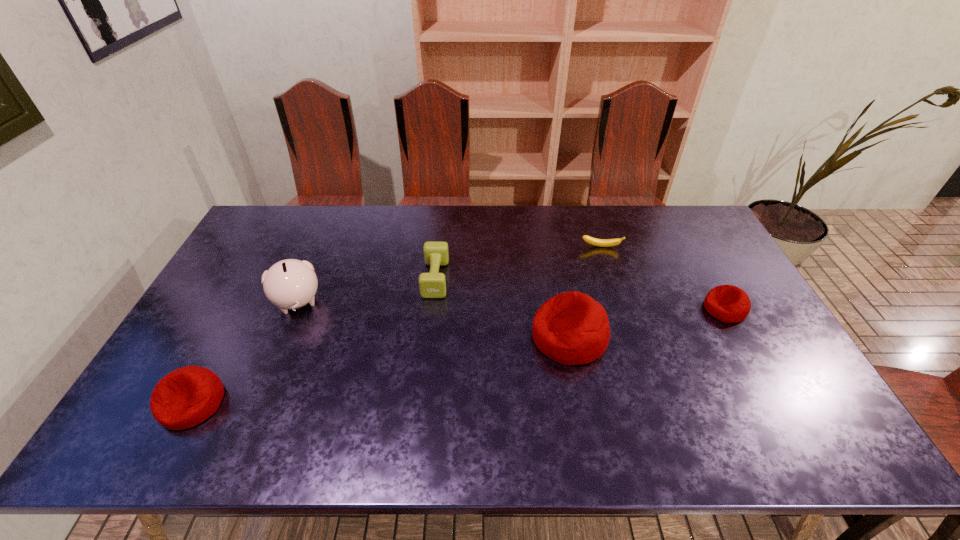
Where is `vacant area in the image that satisfies the following two spatial constraints: 1. at the stem of the banana; 2. on the seat area of the second beanbag from left to right`? The width and height of the screenshot is (960, 540). vacant area in the image that satisfies the following two spatial constraints: 1. at the stem of the banana; 2. on the seat area of the second beanbag from left to right is located at coordinates (630, 336).

Identify the location of blank space that satisfies the following two spatial constraints: 1. on the seat area of the rightmost beanbag; 2. on the seat area of the nearest object. The height and width of the screenshot is (540, 960). (777, 403).